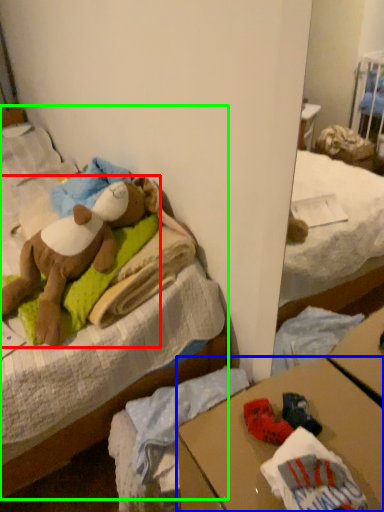
Question: Which object is the closest to the teddy bear (highlighted by a red box)? Choose among these: desk (highlighted by a blue box) or bed (highlighted by a green box).

Choices:
 (A) desk
 (B) bed

Answer: (B)